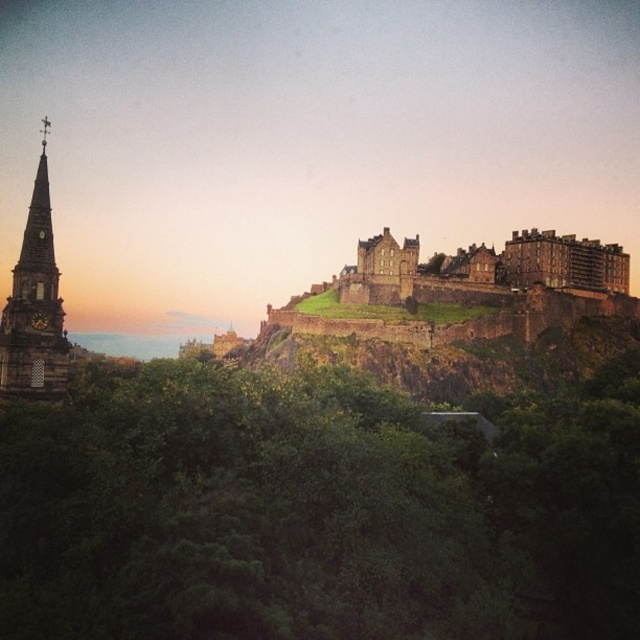
Question: Which object is closer to the camera taking this photo?

Choices:
 (A) dark brown stone steeple at left
 (B) green leafy tree at center

Answer: (B)

Question: Where is green leafy tree at center located in relation to dark brown stone steeple at left in the image?

Choices:
 (A) left
 (B) right

Answer: (B)

Question: Among these points, which one is nearest to the camera?

Choices:
 (A) (356, 618)
 (B) (13, 296)

Answer: (A)

Question: Does green leafy tree at center have a larger size compared to dark brown stone steeple at left?

Choices:
 (A) yes
 (B) no

Answer: (A)

Question: Can you confirm if green leafy tree at center is positioned below dark brown stone steeple at left?

Choices:
 (A) no
 (B) yes

Answer: (B)

Question: Which object is closer to the camera taking this photo?

Choices:
 (A) green leafy tree at center
 (B) dark brown stone steeple at left

Answer: (A)